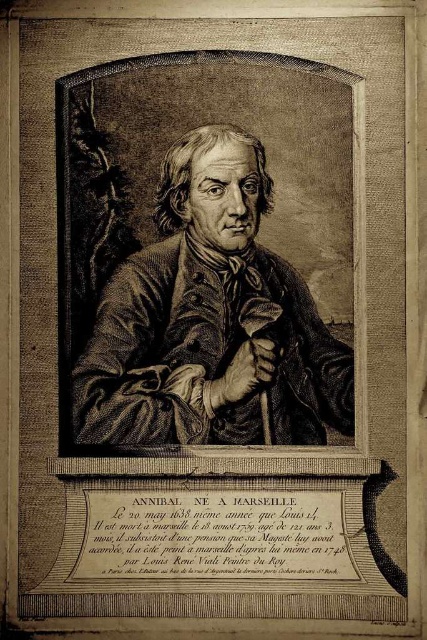
You are a photographer who needs to adjust your camera settings to focus on the etched paper portrait at center. Given that the portrait is 54.12 meters away, what is the minimum distance your camera must be able to focus on to capture it clearly?

The etched paper portrait at center is 54.12 meters from the camera, so the camera must have a focus range that can accommodate at least 54.12 meters to capture it clearly.

You are an art conservator examining a framed artwork. The frame has a width of 1 meter. You need to determine if the etched paper portrait at center and the black paper text at center can fit within the frame without overlapping. Can they fit?

The etched paper portrait at center and the black paper text at center are 8.15 meters apart. Since the frame is only 1 meter wide, the distance between them is much larger than the frame, so they cannot fit within the frame without overlapping.